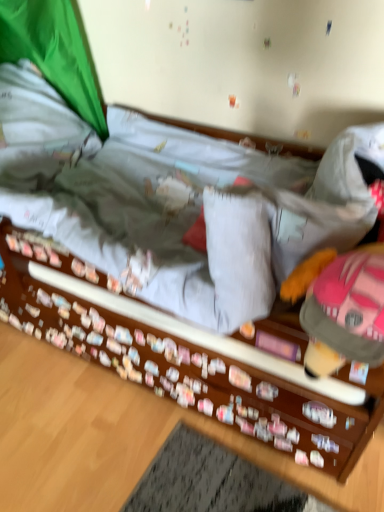
What do you see at coordinates (340, 307) in the screenshot? The image size is (384, 512). I see `pink fabric plush at center` at bounding box center [340, 307].

Identify the location of pink fabric plush at center. The image size is (384, 512). (340, 307).

At what (x,y) coordinates should I click in order to perform the action: click on pink fabric plush at center. Please return your answer as a coordinate pair (x, y). Image resolution: width=384 pixels, height=512 pixels. Looking at the image, I should click on (340, 307).